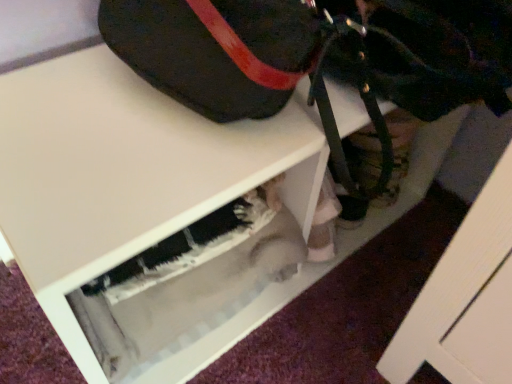
The image size is (512, 384). I want to click on white fluffy cat at lower center, so click(x=188, y=293).

This screenshot has height=384, width=512. What do you see at coordinates (188, 293) in the screenshot?
I see `white fluffy cat at lower center` at bounding box center [188, 293].

In order to face white fluffy cat at lower center, should I rotate leftwards or rightwards?

To face it directly, rotate left by 7.278 degrees.

At what (x,y) coordinates should I click in order to perform the action: click on white fluffy cat at lower center. Please return your answer as a coordinate pair (x, y). Looking at the image, I should click on (188, 293).